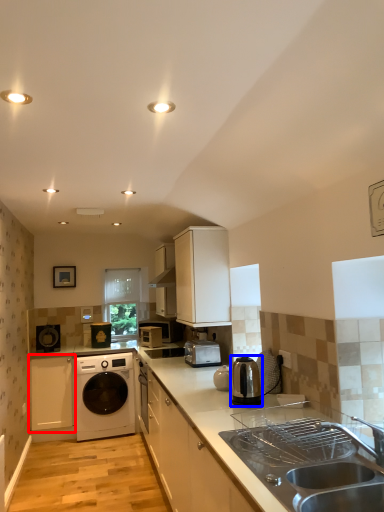
Question: Among these objects, which one is farthest to the camera, cabinetry (highlighted by a red box) or home appliance (highlighted by a blue box)?

Choices:
 (A) cabinetry
 (B) home appliance

Answer: (A)